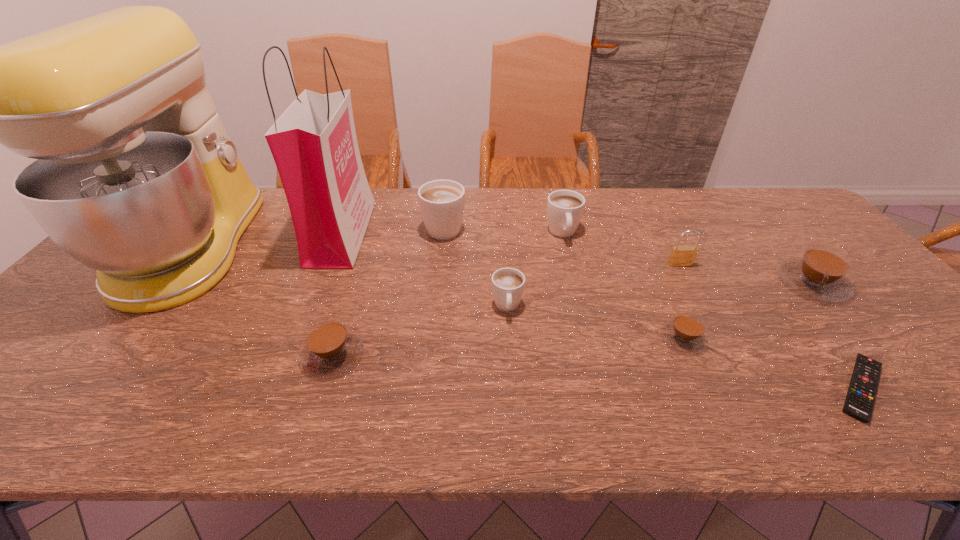
Where is `vacant region located with the handle on the side of the third tallest object`? This screenshot has height=540, width=960. vacant region located with the handle on the side of the third tallest object is located at coordinates (447, 197).

Where is `blank space located 0.200m on the front-facing side of the padlock`? blank space located 0.200m on the front-facing side of the padlock is located at coordinates [709, 319].

Identify the location of vacant space located 0.050m with the handle on the side of the fourth cappuccino from left to right. (569, 258).

This screenshot has height=540, width=960. What are the coordinates of `blank space located 0.190m on the back of the rightmost cappuccino` in the screenshot? It's located at (762, 224).

Where is `free location located 0.220m with the handle on the side of the second white cappuccino from left to right`? The width and height of the screenshot is (960, 540). free location located 0.220m with the handle on the side of the second white cappuccino from left to right is located at coordinates (514, 400).

I want to click on blank space located 0.060m on the left of the second smallest brown cappuccino, so click(x=275, y=354).

Identify the location of vacant space located on the back of the second cappuccino from right to left. The height and width of the screenshot is (540, 960). (662, 294).

Locate an element on the screen. blank space located 0.380m on the back of the remote control is located at coordinates (757, 253).

The height and width of the screenshot is (540, 960). Identify the location of mixer at the far edge. (136, 177).

At what (x,y) coordinates should I click in order to perform the action: click on shopping bag at the far edge. Please return your answer as a coordinate pair (x, y). Looking at the image, I should click on (314, 145).